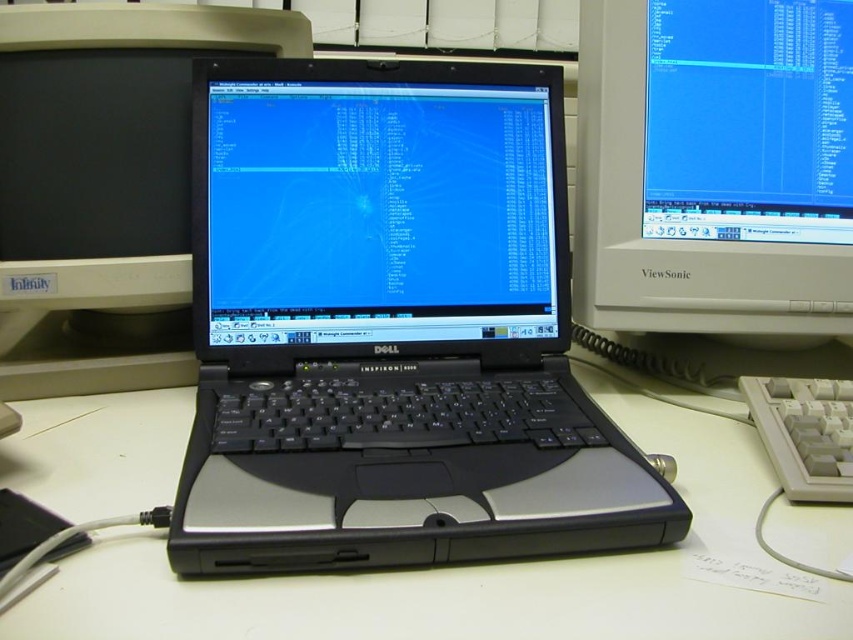
You are organizing a small event and need to place a rectangular tablecloth on the white matte table at center and the white plastic monitor at right. Which object requires a larger tablecloth?

The white matte table at center requires a larger tablecloth since it is bigger than the white plastic monitor at right.

You are positioning a new monitor in the workspace shown. The existing white matte table at center is located at coordinates 0.889, 0.564. Where should you place the new monitor to ensure it aligns with the table?

The white matte table at center is located at coordinates (480,568), so the new monitor should be placed at the same coordinates to align with it.